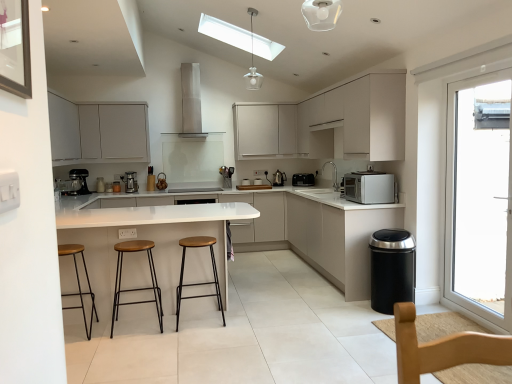
Find the location of a particular element. This screenshot has height=384, width=512. free space in front of wooden seat stool at center, placed as the 2th stool when sorted from left to right is located at coordinates (141, 342).